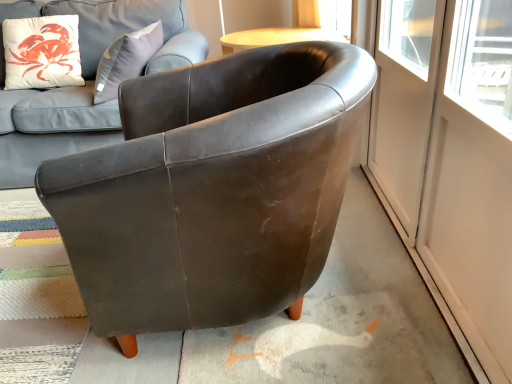
Question: Visually, is matte white cushion at upper left positioned to the left or to the right of brown leather armchair at center?

Choices:
 (A) right
 (B) left

Answer: (B)

Question: From their relative heights in the image, would you say matte white cushion at upper left is taller or shorter than brown leather armchair at center?

Choices:
 (A) short
 (B) tall

Answer: (A)

Question: Which object is the farthest from the matte white cushion at upper left?

Choices:
 (A) matte brown leather couch at upper left
 (B) brown leather armchair at center
 (C) transparent glass screen door at right, which is the 2th screen door from right to left
 (D) transparent glass screen door at right, which is counted as the 1th screen door, starting from the right

Answer: (C)

Question: Considering the real-world distances, which object is closest to the brown leather armchair at center?

Choices:
 (A) transparent glass screen door at right, marked as the first screen door in a left-to-right arrangement
 (B) matte brown leather couch at upper left
 (C) transparent glass screen door at right, which is the second screen door from left to right
 (D) matte white cushion at upper left

Answer: (A)